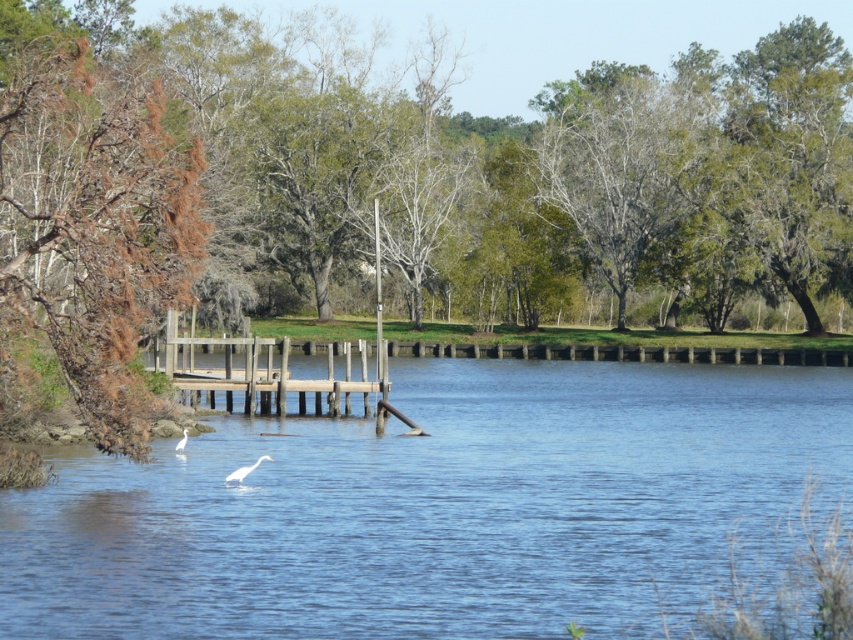
You are standing on the shore and want to place a small statue on the weathered wood dock at left so that it can be seen from the white matte bird at center. Considering their heights, will the statue be visible to the bird?

The weathered wood dock at left is much taller than the white matte bird at center. Since the dock is elevated higher, placing the statue there would make it visible to the bird as long as there are no obstructions between them.

You are standing on the weathered wood dock at left and want to observe the white matte bird at center. Which direction should you look to see the bird?

The white matte bird at center is positioned under the weathered wood dock at left, so you should look downward to see the bird.